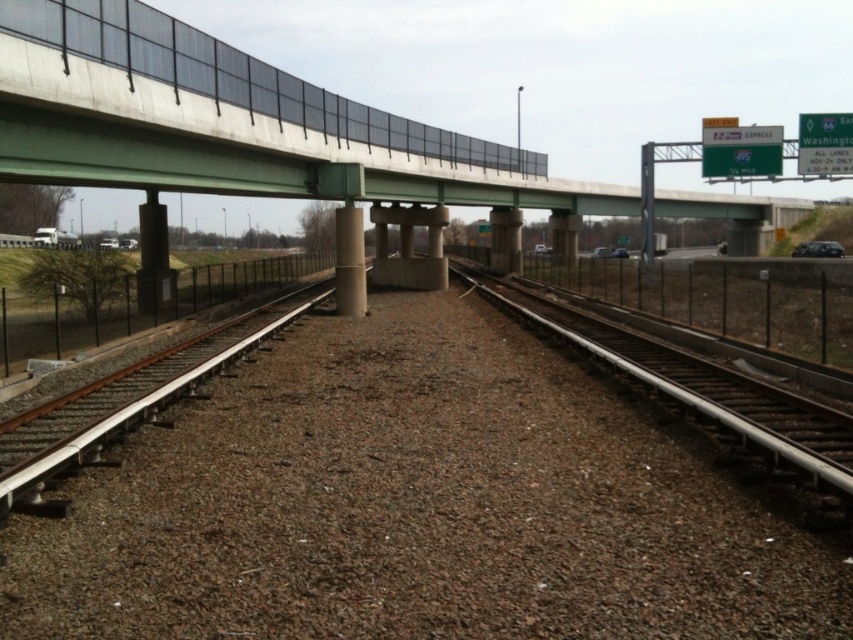
You are a train engineer approaching the bridge. You notice two points marked on your map. Which point is closer to the bridge? The points are point (167, 300) and point (346, 208).

Point (167, 300) is in front of point (346, 208), so it is closer to the bridge.

You are a photographer standing at the railway tracks under the bridge. You want to take a photo of both the point at coordinates point [846,416] and point [151,252]. Which point will appear larger in your photo?

Point [846,416] is closer to the camera than point [151,252], so it will appear larger in the photo.